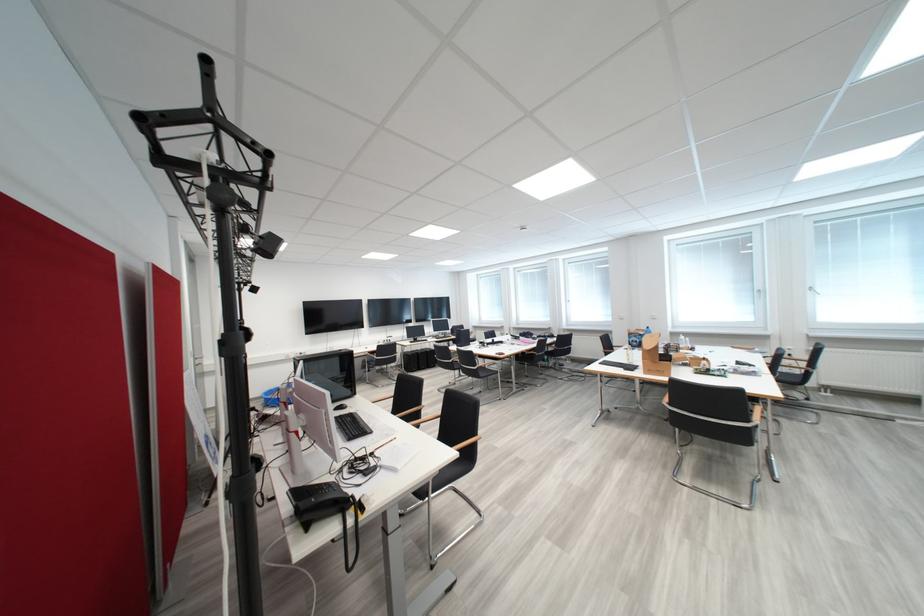
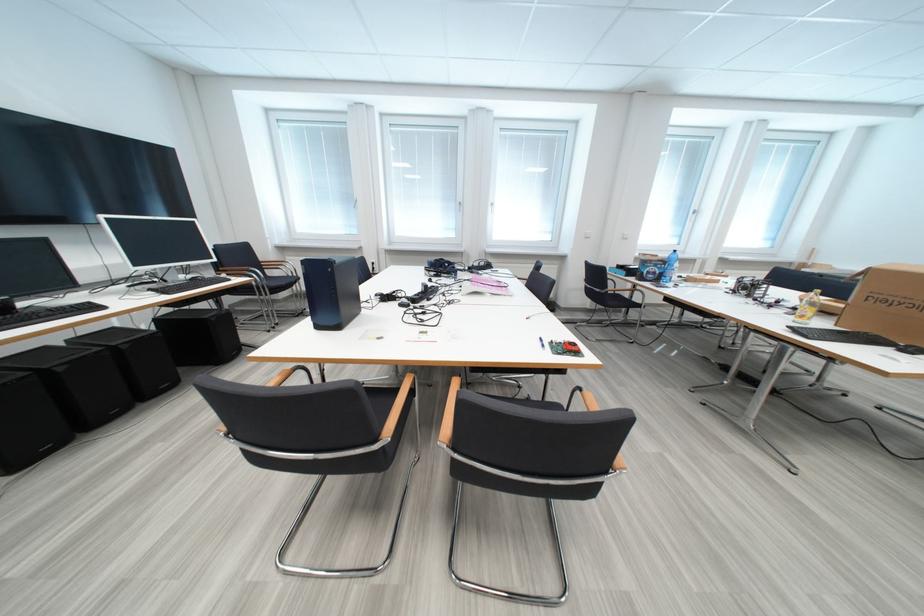
In the second image, find the point that corresponds to (650,337) in the first image.

(675, 265)